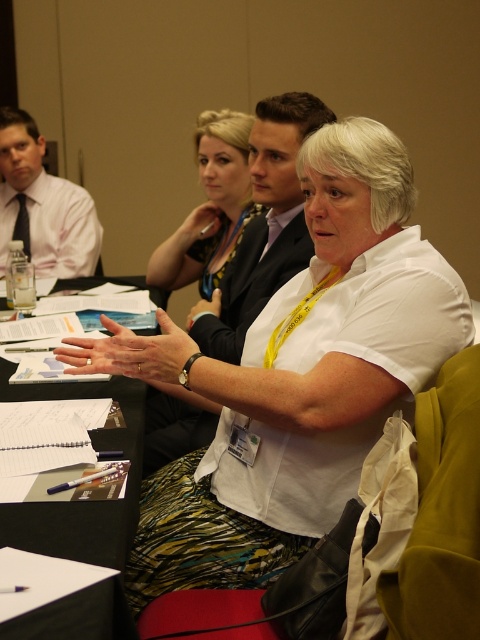
Question: Does black paper at center appear on the right side of matte white shirt at left?

Choices:
 (A) no
 (B) yes

Answer: (B)

Question: Which point is closer to the camera?

Choices:
 (A) black paper at center
 (B) matte black suit at upper center
 (C) matte white shirt at left
 (D) matte black suit at center

Answer: (A)

Question: Which object is farther from the camera taking this photo?

Choices:
 (A) matte white shirt at left
 (B) matte black suit at upper center
 (C) matte black suit at center

Answer: (A)

Question: Which point appears farthest from the camera in this image?

Choices:
 (A) (213, 163)
 (B) (224, 324)
 (C) (91, 196)
 (D) (63, 397)

Answer: (C)

Question: Is matte black suit at center smaller than black paper at center?

Choices:
 (A) no
 (B) yes

Answer: (A)

Question: Does black paper at center appear on the right side of matte black suit at upper center?

Choices:
 (A) yes
 (B) no

Answer: (B)